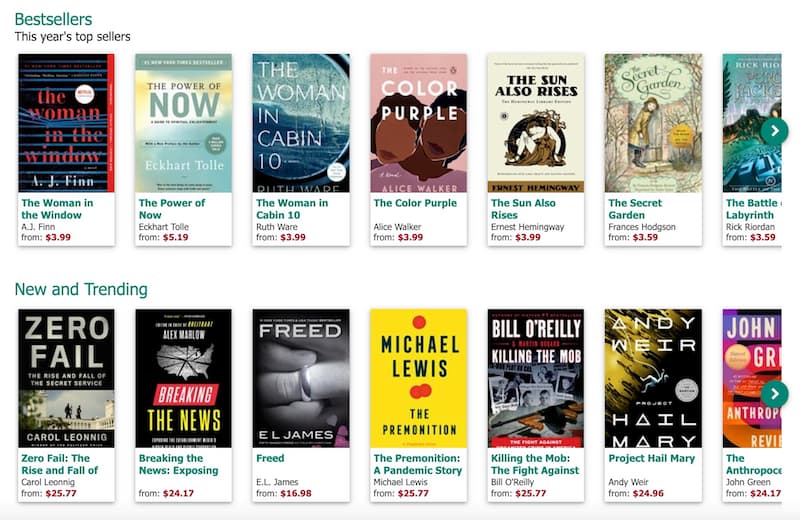
Where is `new books`? The height and width of the screenshot is (520, 800). new books is located at coordinates (46, 386), (180, 387), (308, 388), (424, 388), (528, 389), (648, 388), (728, 364).